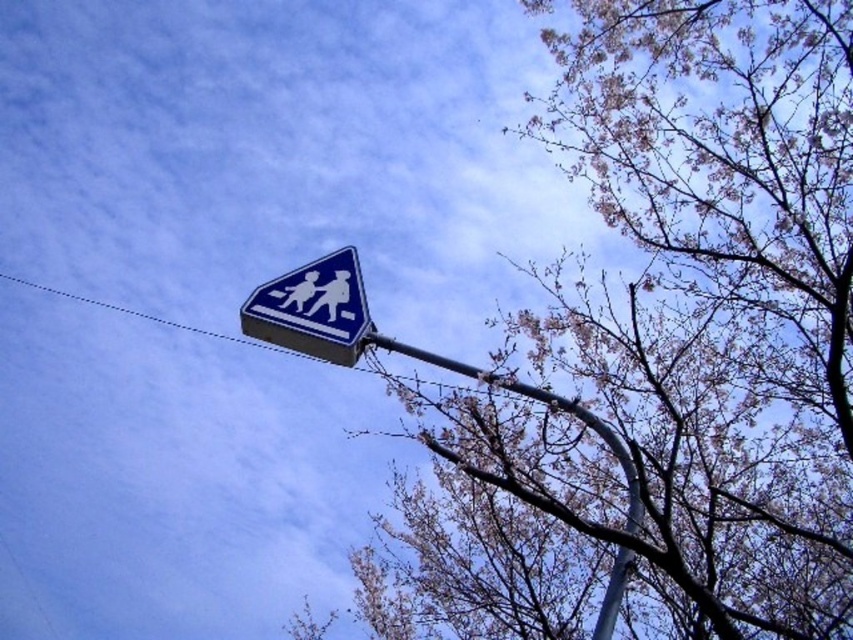
Looking at this image, you are a painter standing at the base of the curved metal pole holding the blue glossy pedestrian crossing sign at upper center. You want to paint the bare branches at upper center but your ladder is only 3 meters long. Can you reach them with your ladder?

The bare branches at upper center is 3.33 meters away from blue glossy pedestrian crossing sign at upper center. Since the ladder is only 3 meters long, you cannot reach the bare branches at upper center.

You are a city planner assessing the visibility of traffic signs. You notice the blue glossy pedestrian crossing sign at upper center and the metallic gray pole at upper center. Which object is wider in terms of their widths?

The blue glossy pedestrian crossing sign at upper center is wider than the metallic gray pole at upper center according to the description.

You are a drone operator trying to capture a photo of the pedestrian crossing sign. The camera is currently positioned at point A, which is at the bottom left corner of the image. You need to adjust the camera to point towards the bare branches at upper center located at point (660,353). What direction should you move the camera to face the bare branches at upper center?

The bare branches at upper center is located at point (660,353), so you should move the camera upwards and to the right from point A to face the bare branches at upper center.